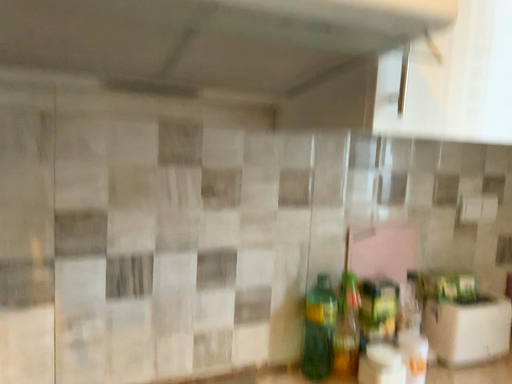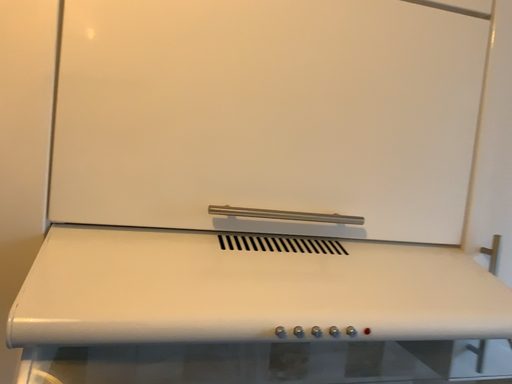
Question: How did the camera likely rotate when shooting the video?

Choices:
 (A) rotated right
 (B) rotated left

Answer: (B)